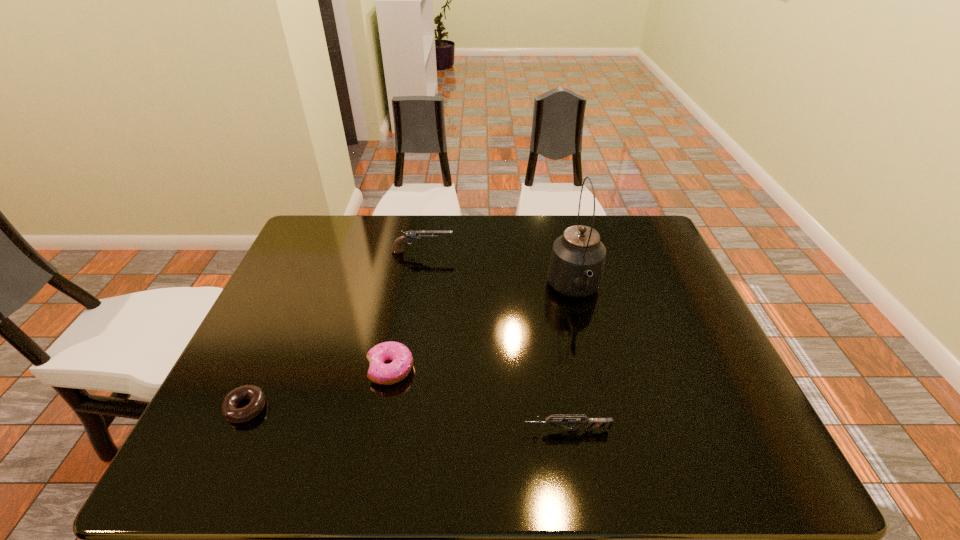
This screenshot has width=960, height=540. I want to click on free space between the taller gun and the farther doughnut, so click(x=406, y=310).

I want to click on free space between the shortest object and the farther gun, so click(x=334, y=330).

This screenshot has height=540, width=960. Identify the location of free point between the second nearest object and the kettle. (411, 349).

Identify the location of free spot between the third nearest object and the shorter gun. Image resolution: width=960 pixels, height=540 pixels. (478, 400).

Locate an element on the screen. This screenshot has height=540, width=960. free space between the left gun and the left doughnut is located at coordinates (334, 330).

At what (x,y) coordinates should I click in order to perform the action: click on free spot between the second farthest object and the shorter doughnut. Please return your answer as a coordinate pair (x, y). The image size is (960, 540). Looking at the image, I should click on (411, 349).

Identify which object is located as the nearest to the taller doughnut. Please provide its 2D coordinates. Your answer should be formatted as a tuple, i.e. [(x, y)], where the tuple contains the x and y coordinates of a point satisfying the conditions above.

[(230, 411)]

Identify which object is the third closest to the right gun. Please provide its 2D coordinates. Your answer should be formatted as a tuple, i.e. [(x, y)], where the tuple contains the x and y coordinates of a point satisfying the conditions above.

[(230, 411)]

Locate an element on the screen. The height and width of the screenshot is (540, 960). free space that satisfies the following two spatial constraints: 1. spout on the kettle; 2. aimed along the barrel of the nearest object is located at coordinates (608, 430).

I want to click on vacant space that satisfies the following two spatial constraints: 1. spout on the kettle; 2. aimed along the barrel of the right gun, so click(608, 430).